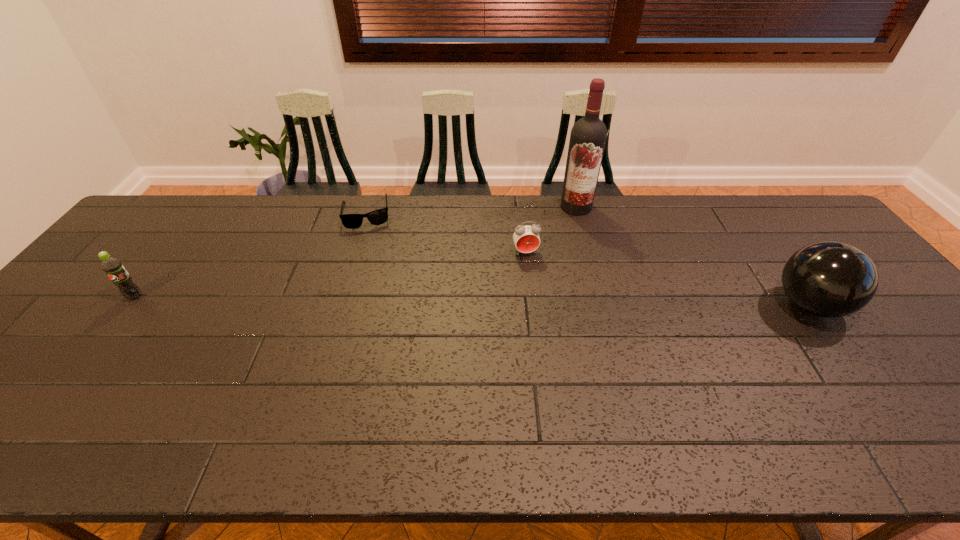
Where is `vacant space in between the tallest object and the bowling ball`? Image resolution: width=960 pixels, height=540 pixels. vacant space in between the tallest object and the bowling ball is located at coordinates (692, 256).

In order to click on free space between the third shortest object and the fourth shortest object in this screenshot , I will do `click(471, 301)`.

Where is `free space between the second object from right to left and the leftmost object`? free space between the second object from right to left and the leftmost object is located at coordinates (355, 252).

Locate an element on the screen. This screenshot has height=540, width=960. unoccupied position between the fourth object from right to left and the fourth object from left to right is located at coordinates (471, 210).

Where is `empty space that is in between the second object from right to left and the leftmost object`? This screenshot has width=960, height=540. empty space that is in between the second object from right to left and the leftmost object is located at coordinates (355, 252).

Where is `vacant space that's between the third nearest object and the rightmost object`? vacant space that's between the third nearest object and the rightmost object is located at coordinates pos(667,279).

Locate an element on the screen. This screenshot has height=540, width=960. unoccupied position between the shortest object and the fourth object from left to right is located at coordinates (471, 210).

At what (x,y) coordinates should I click in order to perform the action: click on free space between the third nearest object and the wine bottle. Please return your answer as a coordinate pair (x, y). The height and width of the screenshot is (540, 960). Looking at the image, I should click on (551, 230).

Where is `free space between the fourth object from left to right and the soda`? free space between the fourth object from left to right and the soda is located at coordinates (355, 252).

Point out which object is positioned as the fourth nearest to the third nearest object. Please provide its 2D coordinates. Your answer should be formatted as a tuple, i.e. [(x, y)], where the tuple contains the x and y coordinates of a point satisfying the conditions above.

[(114, 269)]